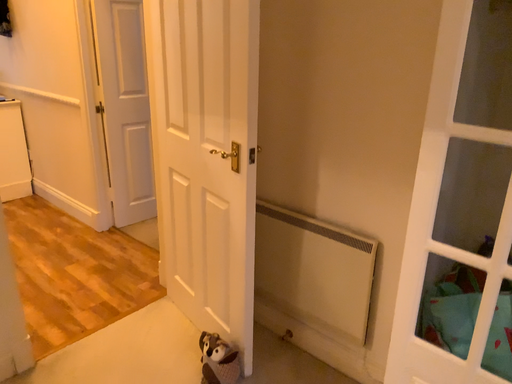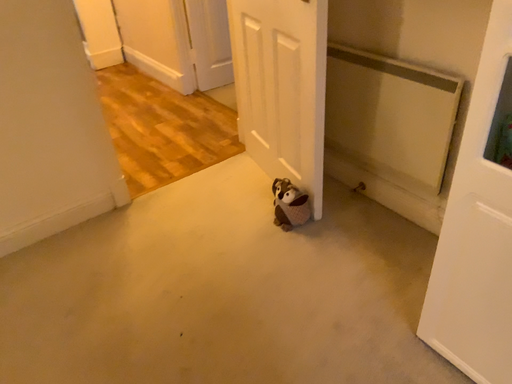
Question: Which way did the camera rotate in the video?

Choices:
 (A) rotated downward
 (B) rotated upward

Answer: (A)